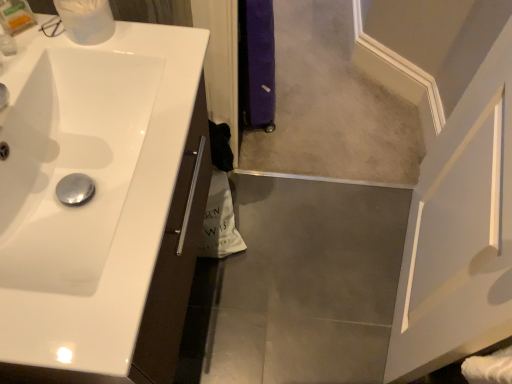
Question: Is white glossy sink at left wider or thinner than translucent plastic container at upper left?

Choices:
 (A) thin
 (B) wide

Answer: (B)

Question: In the image, is white glossy sink at left positioned in front of or behind translucent plastic container at upper left?

Choices:
 (A) behind
 (B) front

Answer: (B)

Question: Estimate the real-world distances between objects in this image. Which object is farther from the white glossy sink at left?

Choices:
 (A) beige carpet at center
 (B) translucent plastic container at upper left

Answer: (A)

Question: Based on their relative distances, which object is farther from the beige carpet at center?

Choices:
 (A) white glossy sink at left
 (B) translucent plastic container at upper left

Answer: (B)